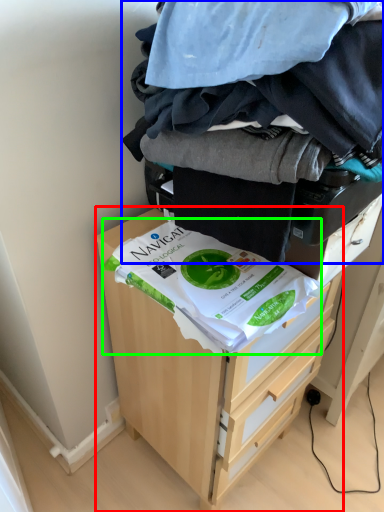
Question: Considering the real-world distances, which object is closest to chest of drawers (highlighted by a red box)? laundry (highlighted by a blue box) or food (highlighted by a green box).

Choices:
 (A) laundry
 (B) food

Answer: (B)